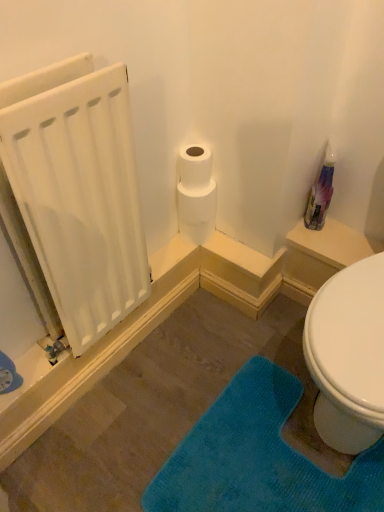
This screenshot has width=384, height=512. I want to click on unoccupied region to the right of translucent plastic spray bottle at upper right, so click(x=343, y=229).